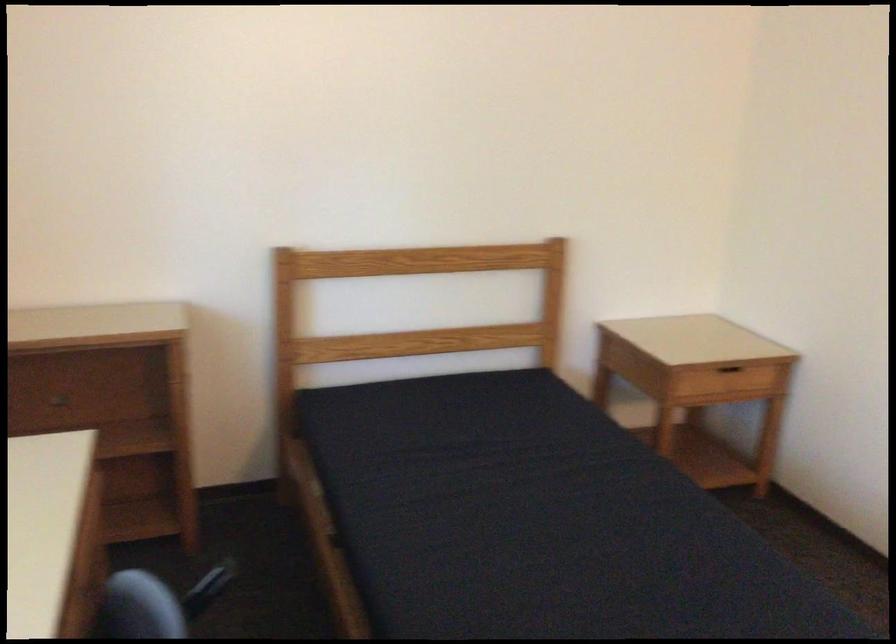
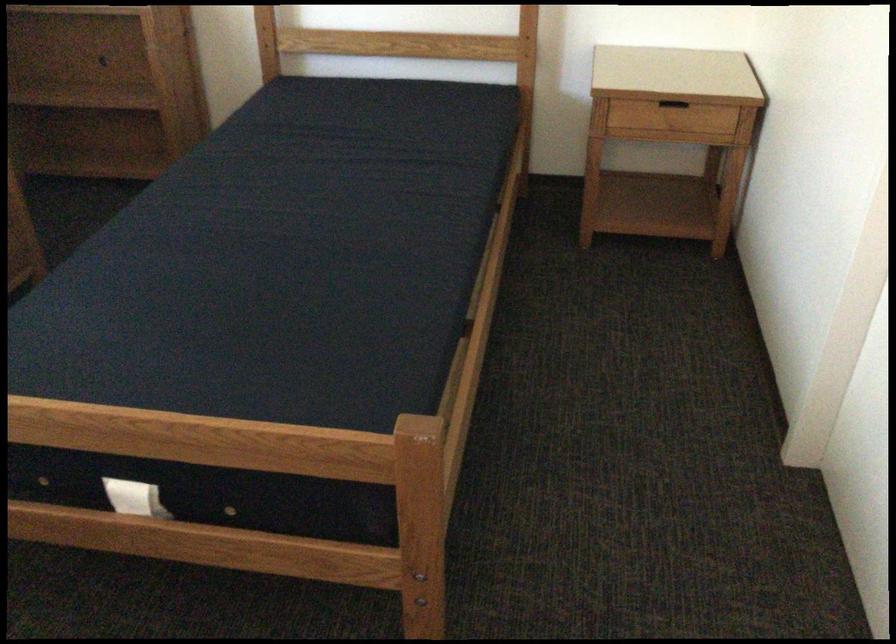
In the second image, find the point that corresponds to the point at 741,374 in the first image.

(673, 109)